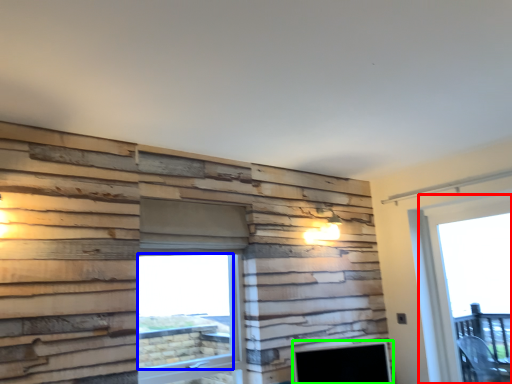
Question: Considering the real-world distances, which object is farthest from window (highlighted by a red box)? window screen (highlighted by a blue box) or fireplace (highlighted by a green box)?

Choices:
 (A) window screen
 (B) fireplace

Answer: (A)